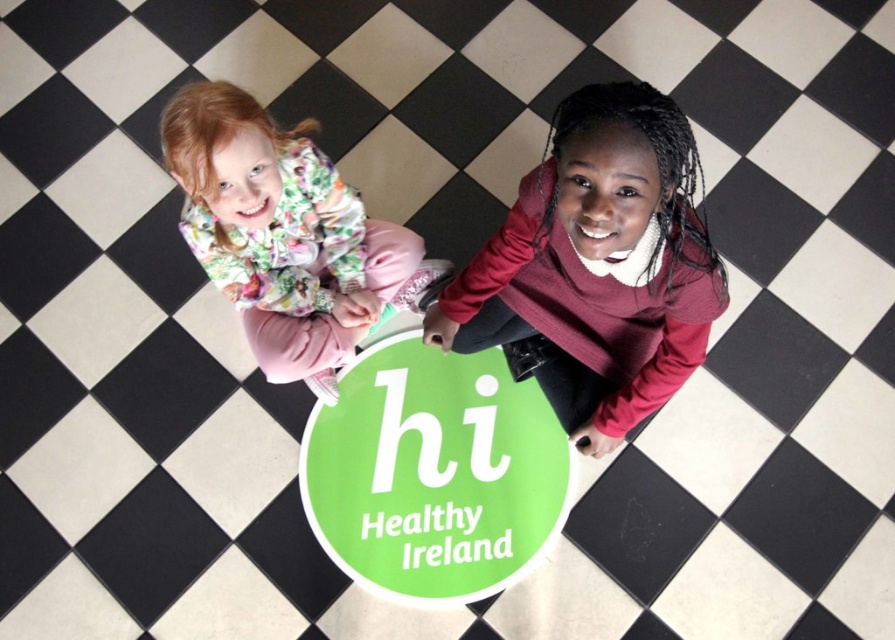
Can you confirm if maroon sweater at center is thinner than floral fabric jacket at upper left?

Correct, maroon sweater at center's width is less than floral fabric jacket at upper left's.

Between point (484, 282) and point (333, 209), which one is positioned behind?

Point (333, 209)

Is point (501, 272) farther from viewer compared to point (297, 304)?

No, (501, 272) is in front of (297, 304).

The image size is (895, 640). What are the coordinates of `maroon sweater at center` in the screenshot? It's located at (598, 264).

Find the location of a particular element. This screenshot has height=640, width=895. green matte sign at center is located at coordinates (433, 474).

Locate an element on the screen. Image resolution: width=895 pixels, height=640 pixels. green matte sign at center is located at coordinates (433, 474).

Which is more to the right, maroon sweater at center or green matte sign at center?

Positioned to the right is maroon sweater at center.

Between maroon sweater at center and green matte sign at center, which one appears on the left side from the viewer's perspective?

green matte sign at center is more to the left.

Between point (611, 192) and point (408, 412), which one is positioned in front?

Point (611, 192) is in front.

Locate an element on the screen. This screenshot has width=895, height=640. maroon sweater at center is located at coordinates (598, 264).